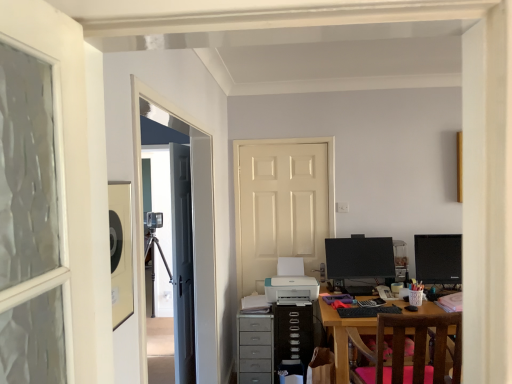
Question: Is the depth of black glossy monitor at right, acting as the second computer monitor starting from the left, less than that of white glossy door at center, the first door viewed from the right?

Choices:
 (A) yes
 (B) no

Answer: (A)

Question: Could you tell me if black glossy monitor at right, the 1th computer monitor positioned from the right, is turned towards white glossy door at center, the first door viewed from the right?

Choices:
 (A) yes
 (B) no

Answer: (B)

Question: From the image's perspective, is black glossy monitor at right, acting as the second computer monitor starting from the left, above white glossy door at center, the first door viewed from the right?

Choices:
 (A) no
 (B) yes

Answer: (A)

Question: Is the position of black glossy monitor at right, acting as the second computer monitor starting from the left, more distant than that of white glossy door at center, acting as the second door starting from the left?

Choices:
 (A) yes
 (B) no

Answer: (B)

Question: Does black glossy monitor at right, the 1th computer monitor positioned from the right, have a larger size compared to white glossy door at center, acting as the second door starting from the left?

Choices:
 (A) yes
 (B) no

Answer: (B)

Question: Which is correct: white glossy door at center, the first door viewed from the right, is inside transparent glass door at upper left, or outside of it?

Choices:
 (A) inside
 (B) outside

Answer: (B)

Question: Is white glossy door at center, acting as the second door starting from the left, wider or thinner than transparent glass door at upper left?

Choices:
 (A) thin
 (B) wide

Answer: (A)

Question: Considering the positions of white glossy door at center, the first door viewed from the right, and transparent glass door at upper left in the image, is white glossy door at center, the first door viewed from the right, taller or shorter than transparent glass door at upper left?

Choices:
 (A) tall
 (B) short

Answer: (A)

Question: From a real-world perspective, is white glossy door at center, acting as the second door starting from the left, above or below transparent glass door at upper left?

Choices:
 (A) below
 (B) above

Answer: (A)

Question: From a real-world perspective, relative to pink fabric chair at lower right, is black glossy monitor at center, placed as the first computer monitor when sorted from left to right, vertically above or below?

Choices:
 (A) below
 (B) above

Answer: (B)

Question: Considering their positions, is black glossy monitor at center, placed as the 2th computer monitor when sorted from right to left, located in front of or behind pink fabric chair at lower right?

Choices:
 (A) front
 (B) behind

Answer: (B)

Question: In terms of height, does black glossy monitor at center, placed as the first computer monitor when sorted from left to right, look taller or shorter compared to pink fabric chair at lower right?

Choices:
 (A) tall
 (B) short

Answer: (B)

Question: Looking at their shapes, would you say black glossy monitor at center, placed as the 2th computer monitor when sorted from right to left, is wider or thinner than pink fabric chair at lower right?

Choices:
 (A) wide
 (B) thin

Answer: (B)

Question: In terms of width, does gray fabric drawer at center look wider or thinner when compared to black glossy monitor at right, acting as the second computer monitor starting from the left?

Choices:
 (A) thin
 (B) wide

Answer: (B)

Question: Choose the correct answer: Is gray fabric drawer at center inside black glossy monitor at right, the 1th computer monitor positioned from the right, or outside it?

Choices:
 (A) outside
 (B) inside

Answer: (A)